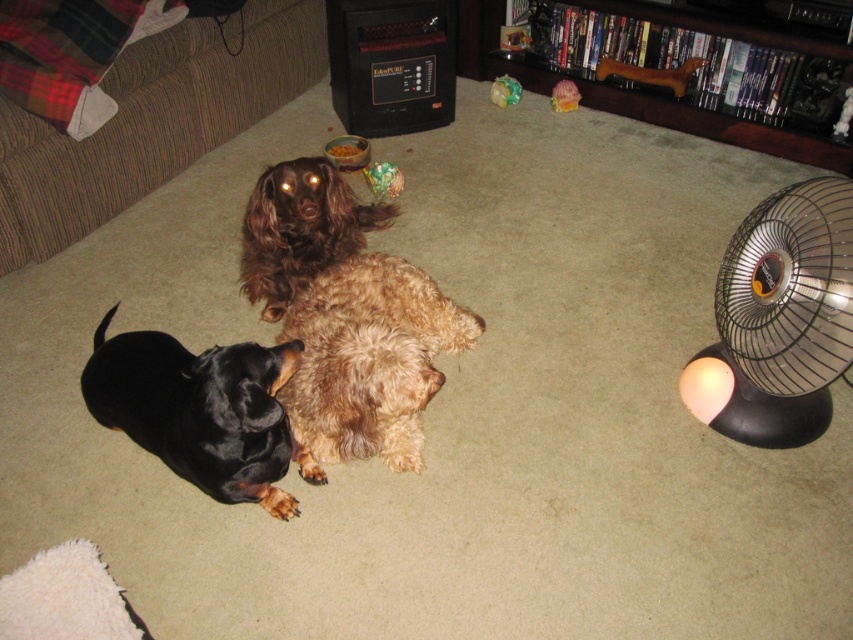
Based on the photo, you are a pet owner who wants to ensure your dogs are comfortable. The black plastic fan at right is currently on. Which dog, the black shiny fur dog at lower left or the light brown Cocker Spaniel in the middle, is more likely to feel the airflow from the fan?

The black shiny fur dog at lower left is more likely to feel the airflow from the black plastic fan at right because the fan is positioned above it, directing air downward.

You are standing in the living room and want to sit on the brown fabric couch at upper left. Based on its position, which direction should you walk to reach it?

The brown fabric couch at upper left is located at point (151, 122), so you should walk towards the upper left direction to reach it.

You are a dog owner who wants to place a new dog bed for the black shiny fur dog at lower left. The brown fabric couch at upper left is in the way. Can you move the couch to make space for the dog bed?

The brown fabric couch at upper left is located above the black shiny fur dog at lower left, so moving the couch would create space for the dog bed.